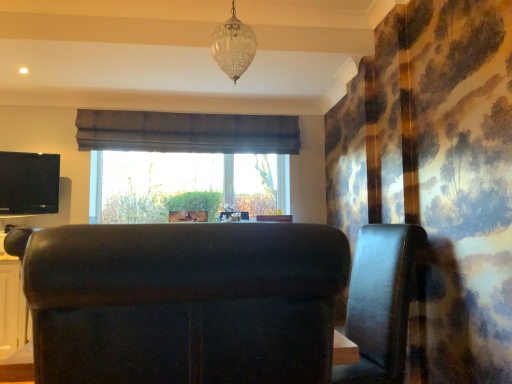
Question: Considering the relative sizes of velvet dark brown armchair at center, arranged as the first furniture when viewed from the left, and leather armchair at center, the 1th furniture from the right, in the image provided, is velvet dark brown armchair at center, arranged as the first furniture when viewed from the left, shorter than leather armchair at center, the 1th furniture from the right,?

Choices:
 (A) no
 (B) yes

Answer: (B)

Question: Is velvet dark brown armchair at center, acting as the second furniture starting from the right, positioned with its back to leather armchair at center, acting as the second furniture starting from the front?

Choices:
 (A) yes
 (B) no

Answer: (B)

Question: From a real-world perspective, is velvet dark brown armchair at center, acting as the second furniture starting from the right, positioned under leather armchair at center, the first furniture from the back, based on gravity?

Choices:
 (A) yes
 (B) no

Answer: (B)

Question: Does velvet dark brown armchair at center, acting as the second furniture starting from the right, have a larger size compared to leather armchair at center, the 1th furniture from the right?

Choices:
 (A) yes
 (B) no

Answer: (B)

Question: Is leather armchair at center, arranged as the second furniture when viewed from the left, located within velvet dark brown armchair at center, which appears as the second furniture when viewed from the back?

Choices:
 (A) no
 (B) yes

Answer: (A)

Question: Based on their positions, is leather armchair at center, arranged as the second furniture when viewed from the left, located to the left or right of clear glass chandelier at upper center?

Choices:
 (A) right
 (B) left

Answer: (A)

Question: In terms of width, does leather armchair at center, acting as the second furniture starting from the front, look wider or thinner when compared to clear glass chandelier at upper center?

Choices:
 (A) wide
 (B) thin

Answer: (A)

Question: Is point (396, 354) closer or farther from the camera than point (219, 36)?

Choices:
 (A) closer
 (B) farther

Answer: (A)

Question: Considering their positions, is leather armchair at center, the 1th furniture from the right, located in front of or behind clear glass chandelier at upper center?

Choices:
 (A) front
 (B) behind

Answer: (A)

Question: In the image, is brown fabric curtain at center positioned in front of or behind velvet dark brown armchair at center, positioned as the first furniture in front-to-back order?

Choices:
 (A) behind
 (B) front

Answer: (A)

Question: Is brown fabric curtain at center bigger or smaller than velvet dark brown armchair at center, positioned as the first furniture in front-to-back order?

Choices:
 (A) small
 (B) big

Answer: (B)

Question: From a real-world perspective, is brown fabric curtain at center physically located above or below velvet dark brown armchair at center, acting as the second furniture starting from the right?

Choices:
 (A) below
 (B) above

Answer: (B)

Question: Is brown fabric curtain at center to the left or to the right of velvet dark brown armchair at center, positioned as the first furniture in front-to-back order, in the image?

Choices:
 (A) right
 (B) left

Answer: (B)

Question: Is clear glass chandelier at upper center wider or thinner than brown fabric curtain at center?

Choices:
 (A) wide
 (B) thin

Answer: (A)

Question: Considering the positions of clear glass chandelier at upper center and brown fabric curtain at center in the image, is clear glass chandelier at upper center bigger or smaller than brown fabric curtain at center?

Choices:
 (A) small
 (B) big

Answer: (A)